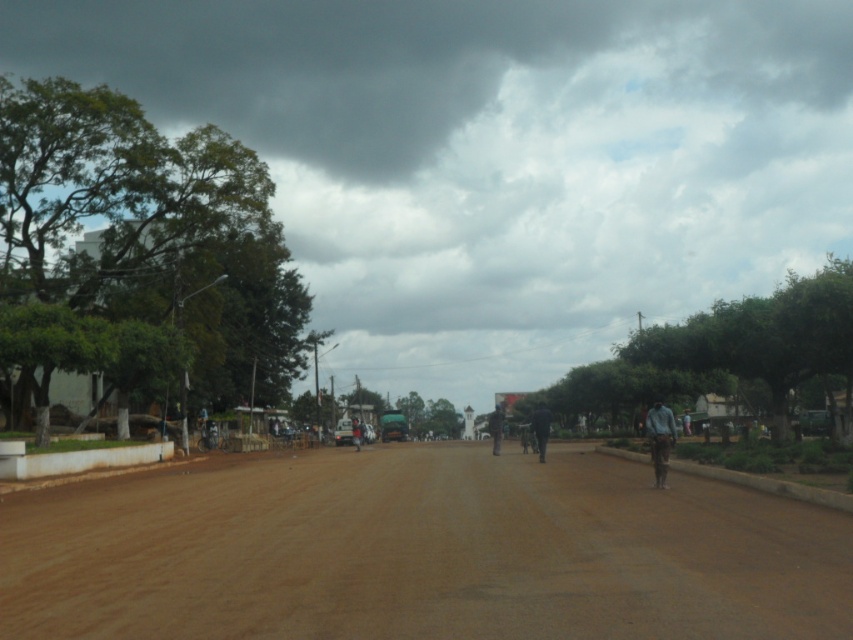
Question: Is dark blue shirt at center to the left of dark blue fabric person at center from the viewer's perspective?

Choices:
 (A) yes
 (B) no

Answer: (B)

Question: Which point is closer to the camera taking this photo?

Choices:
 (A) (541, 442)
 (B) (657, 481)

Answer: (B)

Question: Observing the image, what is the correct spatial positioning of brown dirt track at center in reference to dark blue shirt at center?

Choices:
 (A) above
 (B) below

Answer: (A)

Question: Can you confirm if dark blue uniform at center is smaller than dark blue shirt at center?

Choices:
 (A) no
 (B) yes

Answer: (B)

Question: Based on their relative distances, which object is nearer to the dark blue uniform at center?

Choices:
 (A) light blue fabric shirt at right
 (B) dark blue shirt at center
 (C) dark blue fabric person at center
 (D) brown dirt track at center

Answer: (A)

Question: Which point appears closest to the camera in this image?

Choices:
 (A) (500, 419)
 (B) (354, 417)
 (C) (666, 444)

Answer: (C)